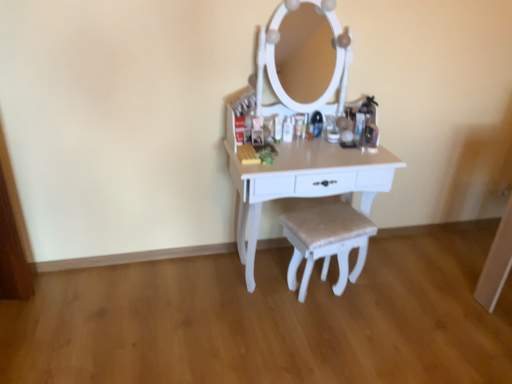
This screenshot has width=512, height=384. In order to click on free point in front of white painted wood table at center in this screenshot , I will do `click(306, 343)`.